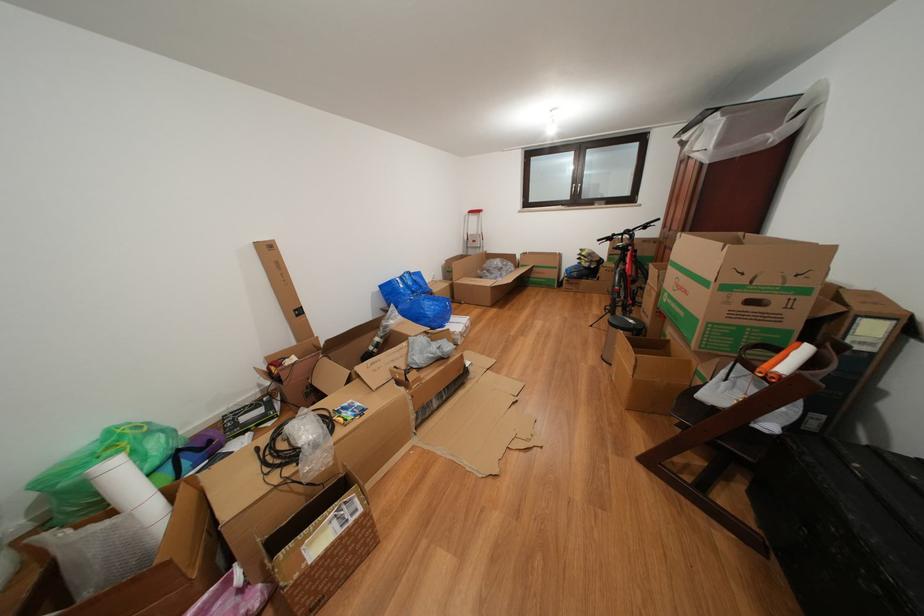
Image resolution: width=924 pixels, height=616 pixels. Describe the element at coordinates (619, 238) in the screenshot. I see `the bicycle handlebar` at that location.